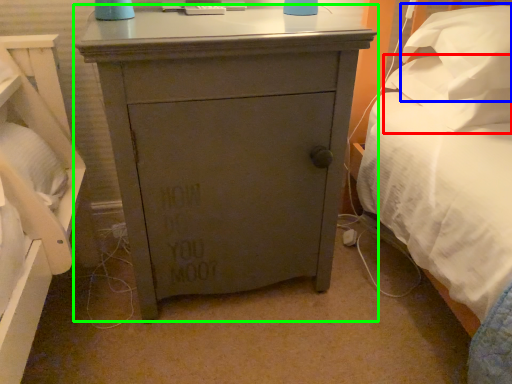
Question: Considering the real-world distances, which object is closest to pillow (highlighted by a red box)? pillow (highlighted by a blue box) or chest of drawers (highlighted by a green box).

Choices:
 (A) pillow
 (B) chest of drawers

Answer: (A)